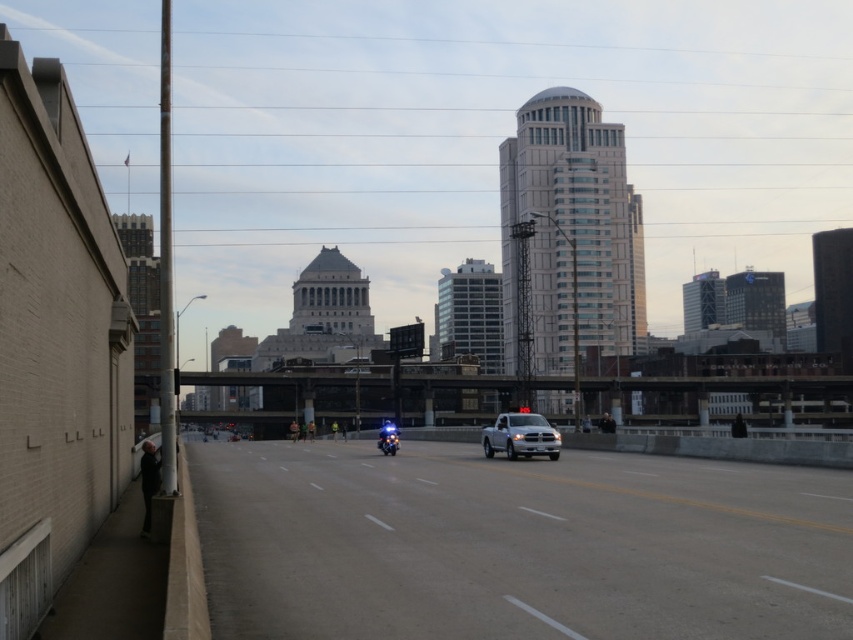
Which is below, gray asphalt highway at center or shiny blue motorcycle at center?

Positioned lower is shiny blue motorcycle at center.

Looking at this image, is gray asphalt highway at center taller than shiny blue motorcycle at center?

Incorrect, gray asphalt highway at center's height is not larger of shiny blue motorcycle at center's.

I want to click on gray asphalt highway at center, so click(x=515, y=545).

Consider the image. Is metallic gray bridge at center further to camera compared to shiny blue motorcycle at center?

That is False.

Who is more distant from viewer, (535, 380) or (378, 432)?

The point (535, 380) is more distant.

Who is more distant from viewer, (567, 385) or (387, 422)?

The point (567, 385) is behind.

You are a GUI agent. You are given a task and a screenshot of the screen. Output one action in this format:
    pyautogui.click(x=<x>, y=<y>)
    Task: Click on the metallic gray bridge at center
    The height and width of the screenshot is (640, 853).
    Given the screenshot: What is the action you would take?
    pyautogui.click(x=699, y=385)

Between gray asphalt highway at center and white matte truck at center, which one is positioned lower?

gray asphalt highway at center

Who is more distant from viewer, (x=520, y=556) or (x=529, y=449)?

The point (x=529, y=449) is behind.

Identify the location of gray asphalt highway at center. The height and width of the screenshot is (640, 853). (515, 545).